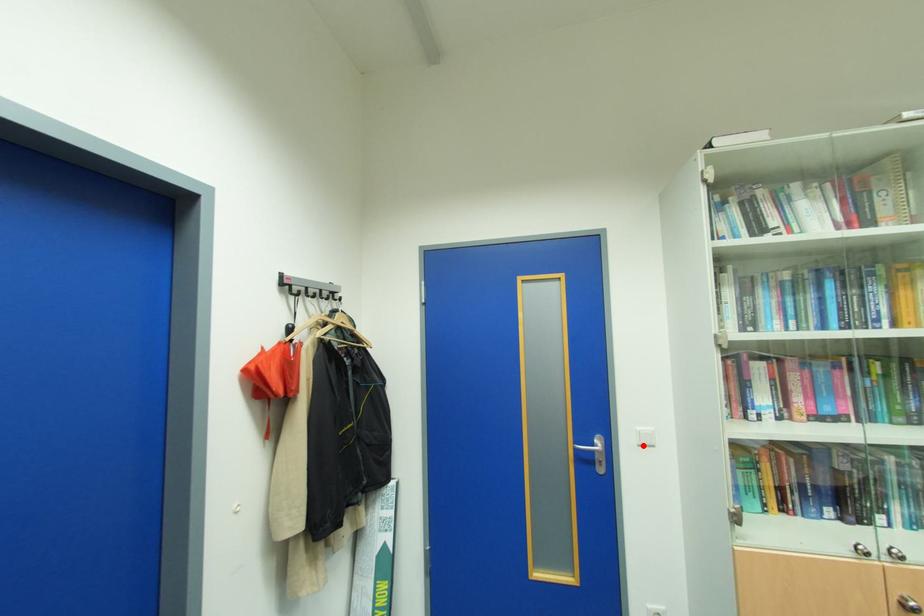
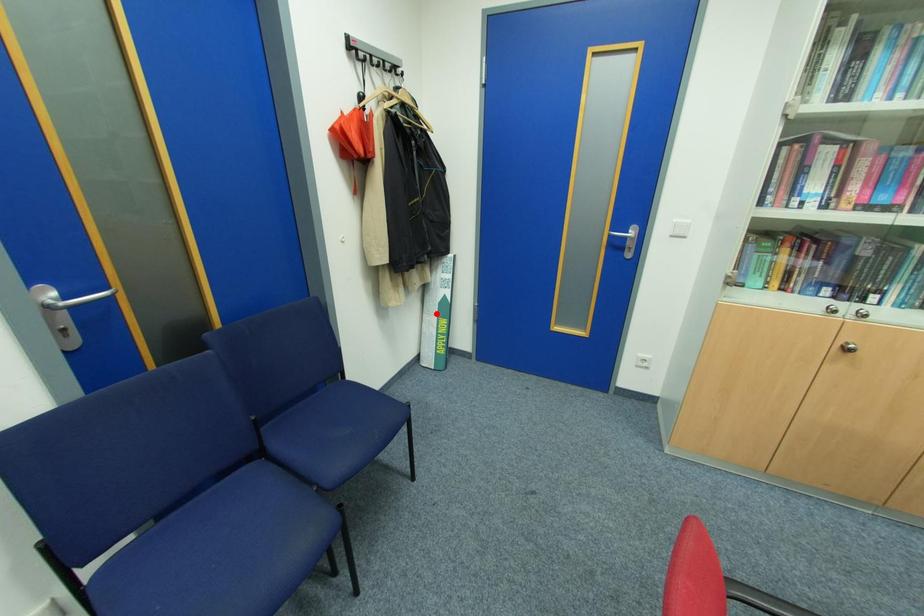
I am providing you with two images of the same scene from different viewpoints. A red point is marked on the first image and another point is marked on the second image. Does the point marked in image1 correspond to the same location as the one in image2?

No